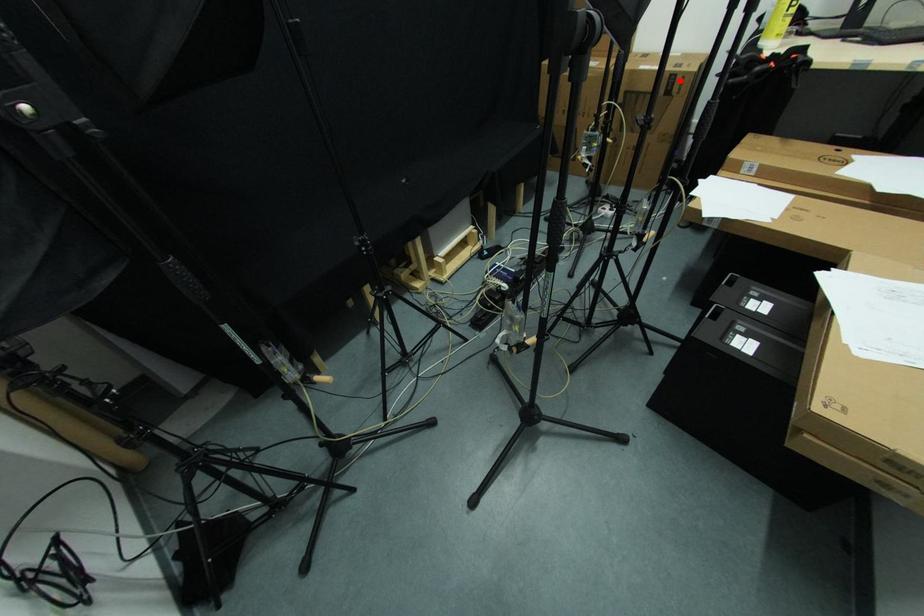
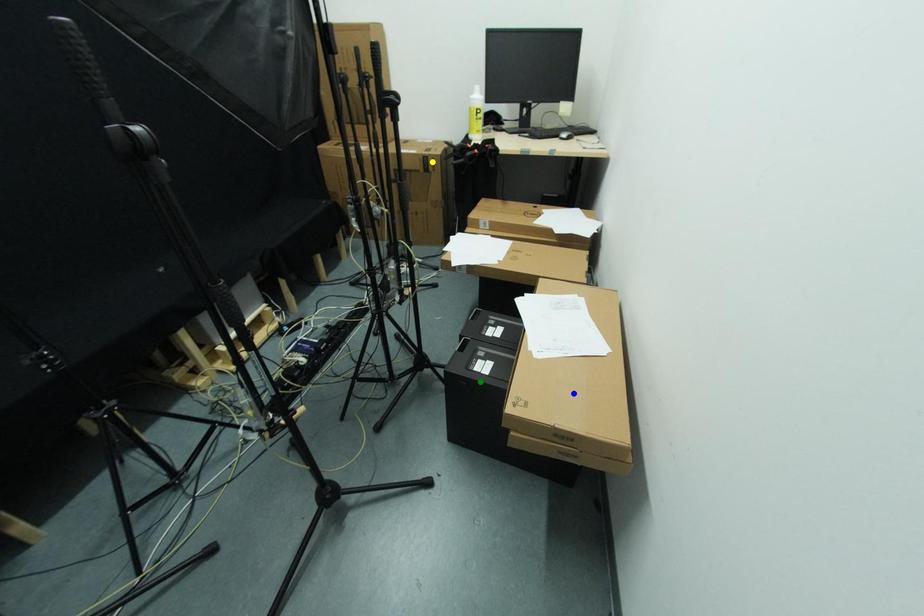
Question: I am providing you with two images of the same scene from different viewpoints. A red point is marked on the first image. You are given multiple points on the second image. Which point in image 2 represents the same 3d spot as the red point in image 1?

Choices:
 (A) yellow point
 (B) blue point
 (C) green point

Answer: (A)